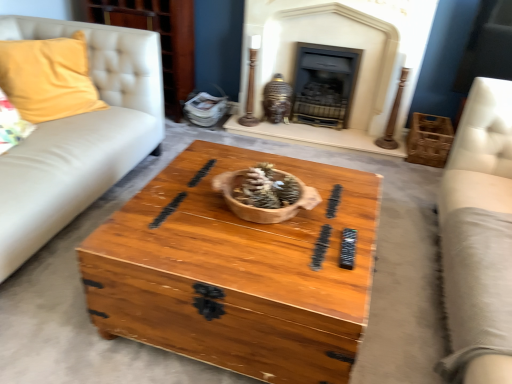
What are the coordinates of `free point above wooden crate at right (from a real-world perspective)` in the screenshot? It's located at (433, 120).